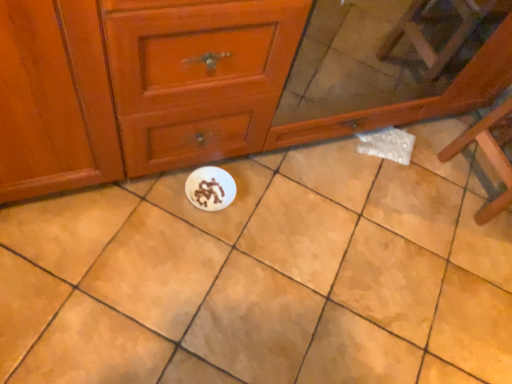
Question: Does white matte paper plate at center appear on the left side of white glossy plate at center?

Choices:
 (A) yes
 (B) no

Answer: (A)

Question: Is white glossy plate at center at the back of white matte paper plate at center?

Choices:
 (A) no
 (B) yes

Answer: (B)

Question: Considering the relative sizes of white matte paper plate at center and white glossy plate at center in the image provided, is white matte paper plate at center wider than white glossy plate at center?

Choices:
 (A) yes
 (B) no

Answer: (B)

Question: Is white matte paper plate at center at the right side of white glossy plate at center?

Choices:
 (A) yes
 (B) no

Answer: (B)

Question: From a real-world perspective, is white matte paper plate at center under white glossy plate at center?

Choices:
 (A) yes
 (B) no

Answer: (B)

Question: Considering the positions of point (38, 380) and point (462, 147), is point (38, 380) closer or farther from the camera than point (462, 147)?

Choices:
 (A) farther
 (B) closer

Answer: (B)

Question: Relative to wooden chair at right, is white glossy plate at center in front or behind?

Choices:
 (A) behind
 (B) front

Answer: (B)

Question: Considering the positions of white glossy plate at center and wooden chair at right in the image, is white glossy plate at center wider or thinner than wooden chair at right?

Choices:
 (A) thin
 (B) wide

Answer: (B)

Question: From a real-world perspective, relative to wooden chair at right, is white glossy plate at center vertically above or below?

Choices:
 (A) above
 (B) below

Answer: (B)

Question: Choose the correct answer: Is matte wood chest of drawers at center inside wooden chair at right or outside it?

Choices:
 (A) outside
 (B) inside

Answer: (A)

Question: Based on their sizes in the image, would you say matte wood chest of drawers at center is bigger or smaller than wooden chair at right?

Choices:
 (A) big
 (B) small

Answer: (A)

Question: Is matte wood chest of drawers at center wider or thinner than wooden chair at right?

Choices:
 (A) thin
 (B) wide

Answer: (B)

Question: Considering their positions, is matte wood chest of drawers at center located in front of or behind wooden chair at right?

Choices:
 (A) front
 (B) behind

Answer: (A)

Question: Based on their sizes in the image, would you say white glossy plate at center is bigger or smaller than matte wood chest of drawers at center?

Choices:
 (A) big
 (B) small

Answer: (B)

Question: Is white glossy plate at center inside or outside of matte wood chest of drawers at center?

Choices:
 (A) outside
 (B) inside

Answer: (A)